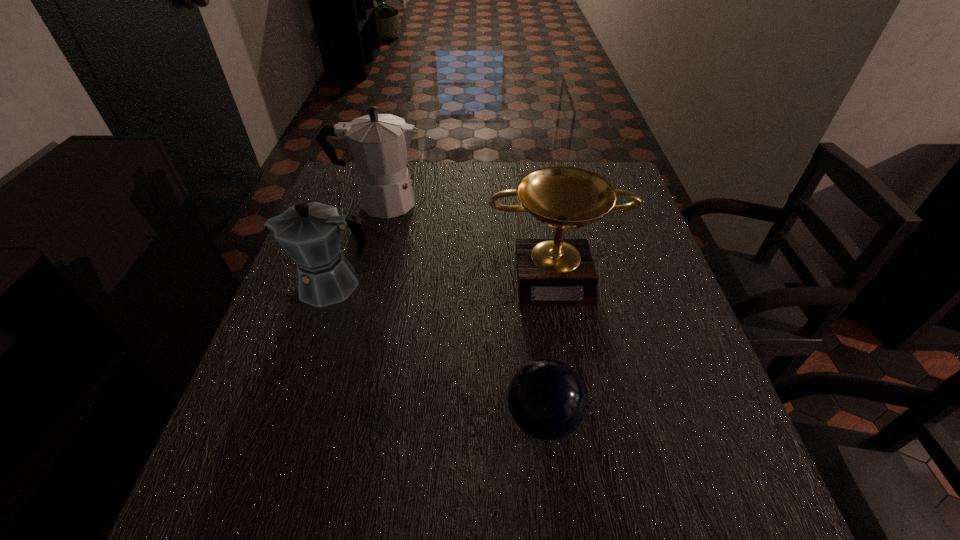
Where is `free region located 0.250m on the surface of the nearest object near the finger holes`? The height and width of the screenshot is (540, 960). free region located 0.250m on the surface of the nearest object near the finger holes is located at coordinates (371, 418).

I want to click on object located at the far edge, so click(379, 143).

Locate an element on the screen. Image resolution: width=960 pixels, height=540 pixels. object that is at the right edge is located at coordinates (550, 272).

At what (x,y) coordinates should I click in order to perform the action: click on object located in the far left corner section of the desktop. Please return your answer as a coordinate pair (x, y). Looking at the image, I should click on (379, 143).

Find the location of a particular element. The height and width of the screenshot is (540, 960). blank space at the far edge of the desktop is located at coordinates (484, 170).

The image size is (960, 540). Identify the location of vacant space at the near edge of the desktop. (593, 522).

Locate an element on the screen. The width and height of the screenshot is (960, 540). vacant space at the left edge is located at coordinates (275, 400).

This screenshot has width=960, height=540. What are the coordinates of `free space at the right edge of the desktop` in the screenshot? It's located at (661, 465).

I want to click on vacant area at the far left corner, so click(x=347, y=177).

At what (x,y) coordinates should I click in order to perform the action: click on free space at the far right corner of the desktop. Please return your answer as a coordinate pair (x, y). This screenshot has height=540, width=960. Looking at the image, I should click on (609, 170).